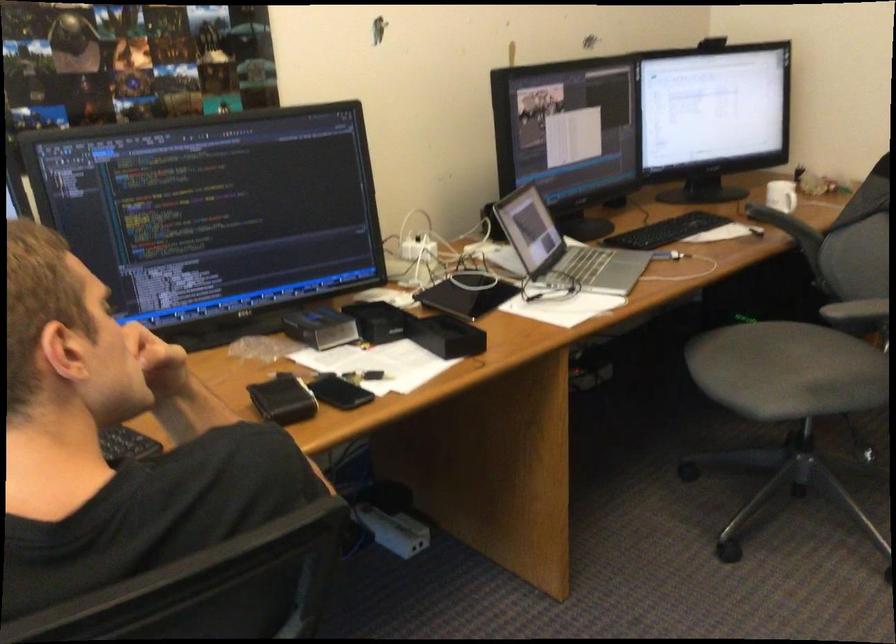
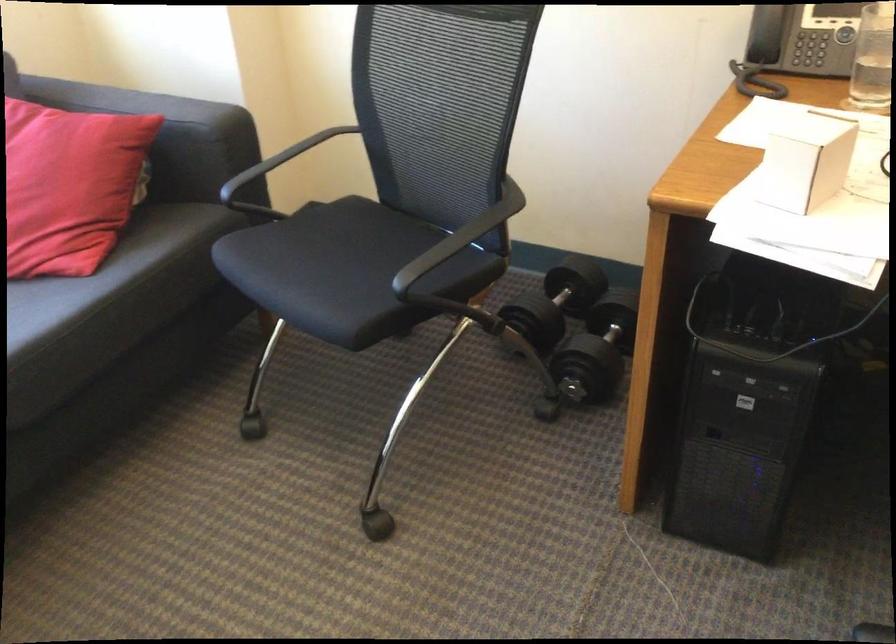
Based on the continuous images, in which direction is the camera rotating?

The rotation direction of the camera is left-down.